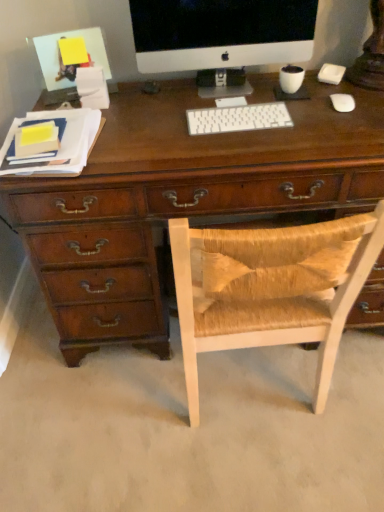
In order to click on woven wood chair at center in this screenshot , I will do `click(270, 288)`.

Is woven wood chair at center surrounding white matte mouse at right?

No, white matte mouse at right is located outside of woven wood chair at center.

Between woven wood chair at center and white matte mouse at right, which one has more height?

woven wood chair at center.

You are a GUI agent. You are given a task and a screenshot of the screen. Output one action in this format:
    pyautogui.click(x=<x>, y=<y>)
    Task: Click on the mouse behind the woven wood chair at center
    
    Given the screenshot: What is the action you would take?
    pyautogui.click(x=342, y=102)

How different are the orientations of woven wood chair at center and white matte mouse at right in degrees?

171 degrees separate the facing orientations of woven wood chair at center and white matte mouse at right.

Would you consider white matte mouse at right to be distant from woven wood chair at center?

No.

Relative to woven wood chair at center, is white matte mouse at right in front or behind?

Clearly, white matte mouse at right is behind woven wood chair at center.

Looking at this image, is white matte mouse at right smaller than woven wood chair at center?

Correct, white matte mouse at right occupies less space than woven wood chair at center.

Which is closer, (334,95) or (246,318)?

The point (246,318) is closer.

Measure the distance between woven wood chair at center and white plastic keyboard at center.

woven wood chair at center and white plastic keyboard at center are 18.93 inches apart from each other.

Do you think woven wood chair at center is within white plastic keyboard at center, or outside of it?

woven wood chair at center is not enclosed by white plastic keyboard at center.

From a real-world perspective, does woven wood chair at center stand above white plastic keyboard at center?

No.

Can you confirm if woven wood chair at center is smaller than white plastic keyboard at center?

No, woven wood chair at center is not smaller than white plastic keyboard at center.

Considering the positions of objects woven wood chair at center and white glossy computer monitor at upper center in the image provided, who is more to the left, woven wood chair at center or white glossy computer monitor at upper center?

From the viewer's perspective, white glossy computer monitor at upper center appears more on the left side.

Where is `chair located in front of the white glossy computer monitor at upper center`? The image size is (384, 512). chair located in front of the white glossy computer monitor at upper center is located at coordinates (x=270, y=288).

From the image's perspective, between woven wood chair at center and white glossy computer monitor at upper center, who is located below?

woven wood chair at center is shown below in the image.

Which of these two, white matte mouse at right or white glossy computer monitor at upper center, is bigger?

white glossy computer monitor at upper center.

Which of these two, white matte mouse at right or white glossy computer monitor at upper center, is thinner?

With smaller width is white matte mouse at right.

Do you think white matte mouse at right is within white glossy computer monitor at upper center, or outside of it?

The correct answer is: outside.

Considering the relative sizes of white matte mouse at right and white glossy computer monitor at upper center in the image provided, is white matte mouse at right taller than white glossy computer monitor at upper center?

Incorrect, the height of white matte mouse at right is not larger of that of white glossy computer monitor at upper center.

Is white plastic keyboard at center spatially inside white matte mouse at right, or outside of it?

The correct answer is: outside.

Considering the positions of point (241, 123) and point (343, 99), is point (241, 123) closer or farther from the camera than point (343, 99)?

Point (241, 123) is positioned closer to the camera compared to point (343, 99).

Based on the photo, from the image's perspective, who appears lower, white plastic keyboard at center or white matte mouse at right?

white plastic keyboard at center, from the image's perspective.

Locate an element on the screen. The width and height of the screenshot is (384, 512). computer keyboard located in front of the white matte mouse at right is located at coordinates (238, 118).

Considering the points (257, 32) and (195, 407), which point is behind, point (257, 32) or point (195, 407)?

Positioned behind is point (195, 407).

How different are the orientations of white glossy computer monitor at upper center and woven wood chair at center in degrees?

The angular difference between white glossy computer monitor at upper center and woven wood chair at center is 180 degrees.

Is white glossy computer monitor at upper center oriented away from woven wood chair at center?

No, woven wood chair at center is not at the back of white glossy computer monitor at upper center.

Considering the relative sizes of white glossy computer monitor at upper center and woven wood chair at center in the image provided, is white glossy computer monitor at upper center taller than woven wood chair at center?

Incorrect, the height of white glossy computer monitor at upper center is not larger of that of woven wood chair at center.

Find the location of a particular element. The width and height of the screenshot is (384, 512). chair below the white matte mouse at right (from the image's perspective) is located at coordinates (270, 288).

Locate an element on the screen. The image size is (384, 512). mouse that is above the woven wood chair at center (from the image's perspective) is located at coordinates click(x=342, y=102).

When comparing their distances from white plastic keyboard at center, does woven wood chair at center or white matte mouse at right seem further?

woven wood chair at center.

Based on their spatial positions, is white glossy computer monitor at upper center or woven wood chair at center further from white matte mouse at right?

woven wood chair at center is positioned further to the anchor white matte mouse at right.

When comparing their distances from white plastic keyboard at center, does white glossy computer monitor at upper center or white matte mouse at right seem closer?

Based on the image, white glossy computer monitor at upper center appears to be nearer to white plastic keyboard at center.

From the image, which object appears to be farther from white plastic keyboard at center, white matte mouse at right or woven wood chair at center?

woven wood chair at center.

Looking at the image, which one is located further to white glossy computer monitor at upper center, white plastic keyboard at center or woven wood chair at center?

The object further to white glossy computer monitor at upper center is woven wood chair at center.

Which object lies nearer to the anchor point woven wood chair at center, white plastic keyboard at center or white glossy computer monitor at upper center?

Based on the image, white plastic keyboard at center appears to be nearer to woven wood chair at center.

When comparing their distances from woven wood chair at center, does white glossy computer monitor at upper center or white plastic keyboard at center seem closer?

Based on the image, white plastic keyboard at center appears to be nearer to woven wood chair at center.

Estimate the real-world distances between objects in this image. Which object is further from woven wood chair at center, white glossy computer monitor at upper center or white matte mouse at right?

white glossy computer monitor at upper center.

You are a GUI agent. You are given a task and a screenshot of the screen. Output one action in this format:
    pyautogui.click(x=<x>, y=<y>)
    Task: Click on the computer keyboard between white matte mouse at right and woven wood chair at center in the up-down direction
    The height and width of the screenshot is (512, 384).
    Given the screenshot: What is the action you would take?
    pyautogui.click(x=238, y=118)

This screenshot has width=384, height=512. Identify the location of computer keyboard between white glossy computer monitor at upper center and white matte mouse at right in the horizontal direction. (238, 118).

Where is `computer keyboard between white glossy computer monitor at upper center and woven wood chair at center in the vertical direction`? This screenshot has height=512, width=384. computer keyboard between white glossy computer monitor at upper center and woven wood chair at center in the vertical direction is located at coordinates (238, 118).

This screenshot has height=512, width=384. In order to click on mouse between white glossy computer monitor at upper center and woven wood chair at center from top to bottom in this screenshot , I will do `click(342, 102)`.